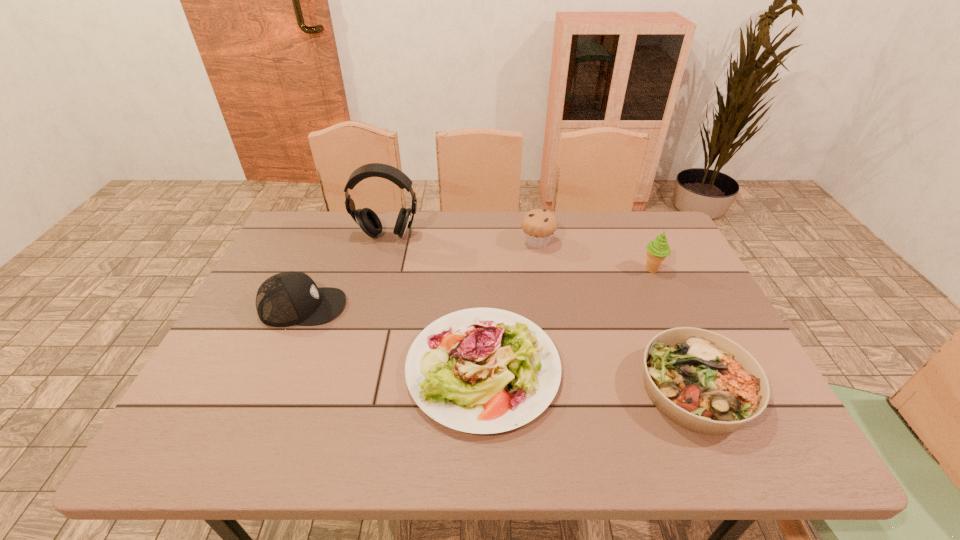
The height and width of the screenshot is (540, 960). I want to click on free region that satisfies the following two spatial constraints: 1. on the back side of the left salad plate; 2. on the front-facing side of the cap, so click(x=483, y=307).

Identify the location of free spot that satisfies the following two spatial constraints: 1. on the ear cups of the earphone; 2. on the right side of the muffin. point(385,242).

Identify the location of blank area in the image that satisfies the following two spatial constraints: 1. on the front-facing side of the cap; 2. on the left side of the left salad plate. This screenshot has height=540, width=960. (276, 368).

Where is `free spot that satisfies the following two spatial constraints: 1. on the back side of the right salad plate; 2. on the right side of the second tallest object`? free spot that satisfies the following two spatial constraints: 1. on the back side of the right salad plate; 2. on the right side of the second tallest object is located at coordinates (643, 269).